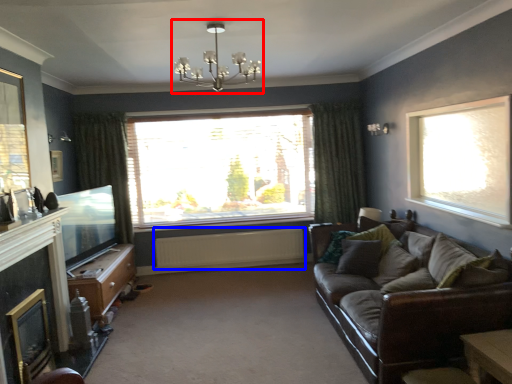
Question: Which object appears farthest to the camera in this image, light fixture (highlighted by a red box) or radiator (highlighted by a blue box)?

Choices:
 (A) light fixture
 (B) radiator

Answer: (B)